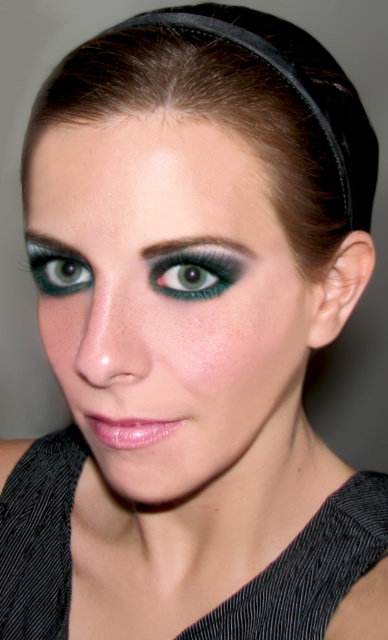
Question: Is dark brown shiny hair at upper center bigger than dark green matte eyebrow at upper center?

Choices:
 (A) yes
 (B) no

Answer: (A)

Question: Does dark brown shiny hair at upper center have a lesser width compared to matte black eyebrow at upper left?

Choices:
 (A) yes
 (B) no

Answer: (B)

Question: Is matte black eye makeup at center below teal matte eye at center?

Choices:
 (A) yes
 (B) no

Answer: (A)

Question: Which point appears closest to the camera in this image?

Choices:
 (A) coord(284,28)
 (B) coord(190,385)
 (C) coord(31,250)
 (D) coord(64,282)

Answer: (B)

Question: Considering the real-world distances, which object is closest to the matte black eyebrow at upper left?

Choices:
 (A) teal matte eye at upper left
 (B) dark green matte eyebrow at upper center
 (C) matte black eye makeup at center

Answer: (A)

Question: Which object is the closest to the teal matte eye at upper left?

Choices:
 (A) dark green matte eyebrow at upper center
 (B) dark brown shiny hair at upper center
 (C) matte black eye makeup at center

Answer: (A)